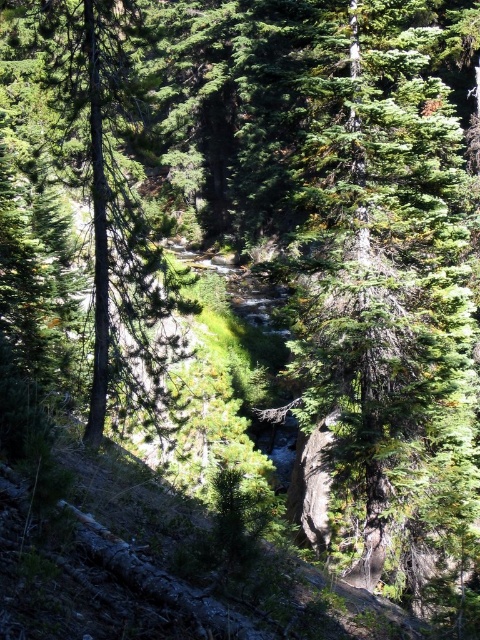
Question: Which of the following is the farthest from the observer?

Choices:
 (A) (440, 276)
 (B) (113, 17)

Answer: (B)

Question: Does green textured tree at center have a lesser width compared to green rough bark tree at center?

Choices:
 (A) no
 (B) yes

Answer: (B)

Question: Does green textured tree at center have a lesser width compared to green rough bark tree at center?

Choices:
 (A) no
 (B) yes

Answer: (B)

Question: Is green textured tree at center to the right of green rough bark tree at center from the viewer's perspective?

Choices:
 (A) yes
 (B) no

Answer: (A)

Question: Which point is farther to the camera?

Choices:
 (A) (70, 45)
 (B) (357, 161)

Answer: (A)